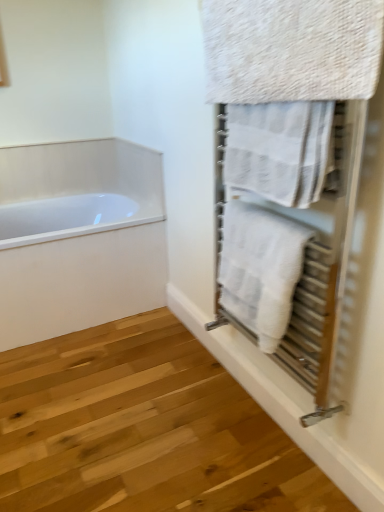
Question: Considering the positions of textured beige towel at upper right, the third towel from the bottom, and white textured towel at upper right, arranged as the 2th towel when ordered from the bottom, in the image, is textured beige towel at upper right, the third towel from the bottom, taller or shorter than white textured towel at upper right, arranged as the 2th towel when ordered from the bottom,?

Choices:
 (A) tall
 (B) short

Answer: (A)

Question: From the image's perspective, is textured beige towel at upper right, the third towel from the bottom, above or below white textured towel at upper right, arranged as the 2th towel when ordered from the bottom?

Choices:
 (A) below
 (B) above

Answer: (B)

Question: Which object is positioned farthest from the textured beige towel at upper right, arranged as the 1th towel when viewed from the top?

Choices:
 (A) white textured towel at right, the first towel positioned from the bottom
 (B) white glossy bathtub at left
 (C) white textured towel at upper right, acting as the second towel starting from the top

Answer: (B)

Question: Based on their relative distances, which object is nearer to the white textured towel at right, the first towel positioned from the bottom?

Choices:
 (A) textured beige towel at upper right, the third towel from the bottom
 (B) white glossy bathtub at left
 (C) white textured towel at upper right, arranged as the 2th towel when ordered from the bottom

Answer: (C)